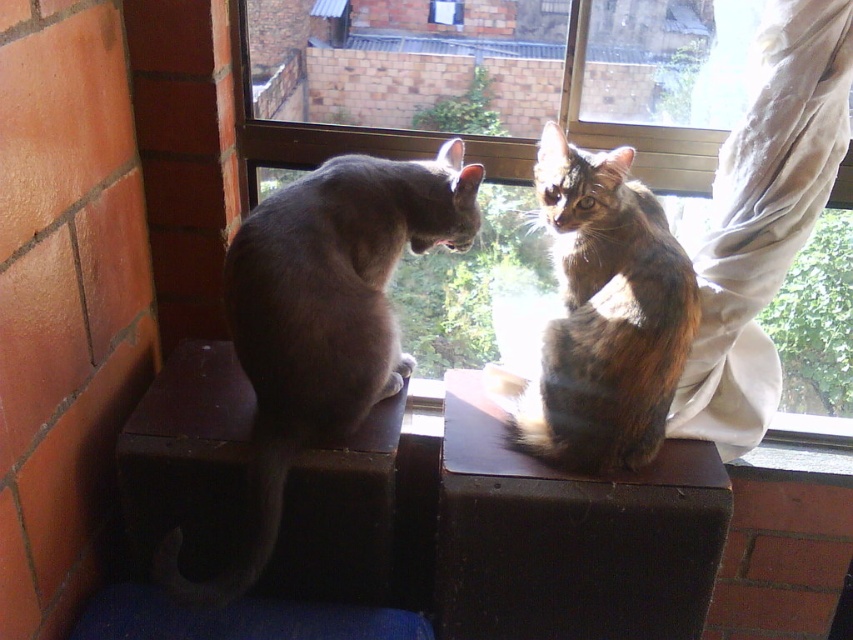
You are a cat owner who wants to ensure your cats can comfortably sit on the windowsill. Given the transparent glass window at center and the tabby fur cat at center, which object is taller and could potentially block the cat from seeing outside?

The transparent glass window at center has a greater height compared to the tabby fur cat at center, so it could potentially block the cat from seeing outside.

You are a cat owner trying to decide if your gray fur cat at left can jump onto the transparent glass window at center. Based on their current positions, can your cat reach the window?

The transparent glass window at center is located above the gray fur cat at left, so the cat would need to jump upwards to reach it. Since cats are known for their agility and jumping abilities, it is likely the gray fur cat at left can reach the transparent glass window at center.

You are a cat owner who wants to ensure your cats are safe. You notice the transparent glass window at center and the tabby fur cat at center. Which object is positioned higher in the image?

The transparent glass window at center is positioned higher than the tabby fur cat at center in the image.